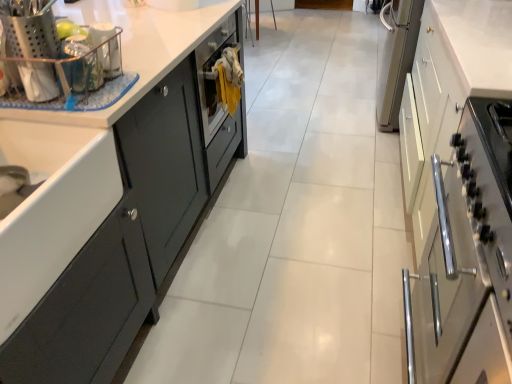
Question: Is point (475, 130) positioned closer to the camera than point (106, 67)?

Choices:
 (A) farther
 (B) closer

Answer: (B)

Question: From the image's perspective, is satin white cabinet at right, the first cabinetry in the right-to-left sequence, located above or below metallic wire basket at upper left, which appears as the first appliance when viewed from the right?

Choices:
 (A) below
 (B) above

Answer: (A)

Question: Estimate the real-world distances between objects in this image. Which object is farther from the satin white cabinet at right, the first cabinetry in the right-to-left sequence?

Choices:
 (A) metallic silver utensil holder at upper left, which is counted as the 1th appliance, starting from the left
 (B) metallic wire basket at upper left, the second appliance positioned from the left
 (C) matte dark gray cabinet at left, the 2th cabinetry positioned from the right
 (D) white glossy countertop at center

Answer: (A)

Question: Estimate the real-world distances between objects in this image. Which object is farther from the white glossy countertop at center?

Choices:
 (A) matte dark gray cabinet at left, which ranks as the 1th cabinetry in left-to-right order
 (B) metallic silver utensil holder at upper left, which is the second appliance in back-to-front order
 (C) metallic wire basket at upper left, which appears as the first appliance when viewed from the right
 (D) satin white cabinet at right, which is the second cabinetry in left-to-right order

Answer: (D)